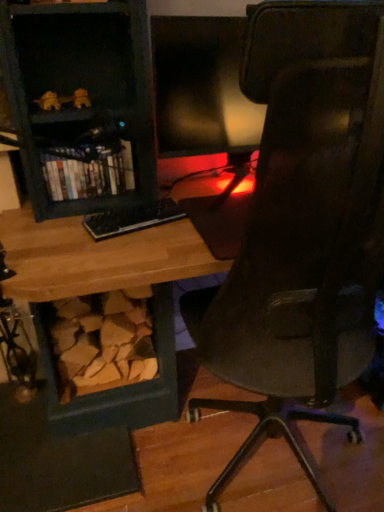
The image size is (384, 512). What are the coordinates of `vacant space to the right of black plastic keyboard at center` in the screenshot? It's located at (195, 230).